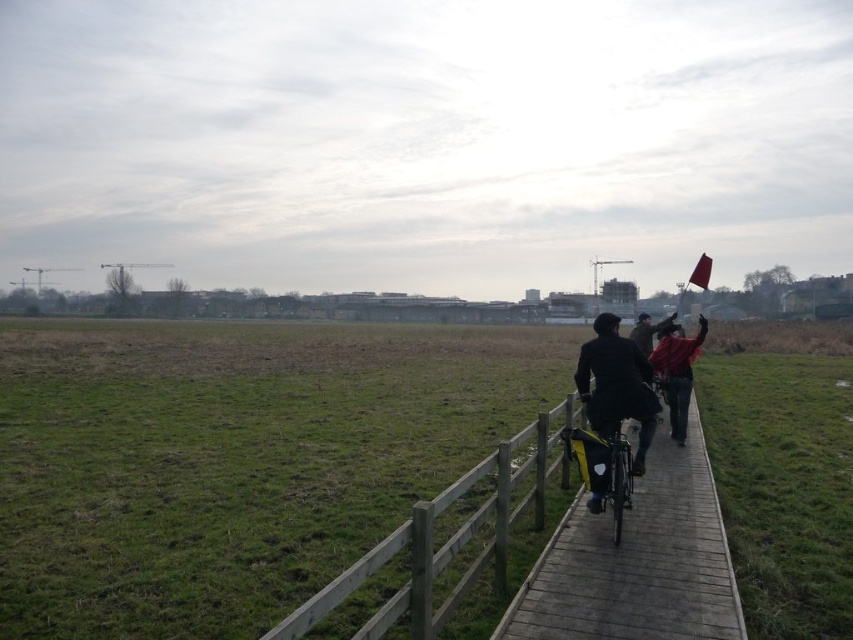
Which of these two, wooden fence at center or shiny metallic bicycle at center, stands shorter?

wooden fence at center

Which is more to the right, wooden fence at center or shiny metallic bicycle at center?

shiny metallic bicycle at center

Image resolution: width=853 pixels, height=640 pixels. What do you see at coordinates (451, 534) in the screenshot?
I see `wooden fence at center` at bounding box center [451, 534].

This screenshot has height=640, width=853. In order to click on wooden fence at center in this screenshot , I will do `click(451, 534)`.

Who is higher up, shiny metallic bicycle at center or dark blue jacket at center?

dark blue jacket at center is above.

Based on the photo, does shiny metallic bicycle at center lie behind dark blue jacket at center?

No, shiny metallic bicycle at center is closer to the viewer.

The height and width of the screenshot is (640, 853). What are the coordinates of `shiny metallic bicycle at center` in the screenshot? It's located at (604, 468).

Locate an element on the screen. The width and height of the screenshot is (853, 640). shiny metallic bicycle at center is located at coordinates (604, 468).

Can you confirm if wooden fence at center is wider than red fabric flag at right?

No, wooden fence at center is not wider than red fabric flag at right.

Measure the distance between wooden fence at center and red fabric flag at right.

wooden fence at center is 7.03 meters away from red fabric flag at right.

Find the location of a particular element. wooden fence at center is located at coordinates (451, 534).

You are a GUI agent. You are given a task and a screenshot of the screen. Output one action in this format:
    pyautogui.click(x=<x>, y=<y>)
    Task: Click on the wooden fence at center
    
    Given the screenshot: What is the action you would take?
    pyautogui.click(x=451, y=534)